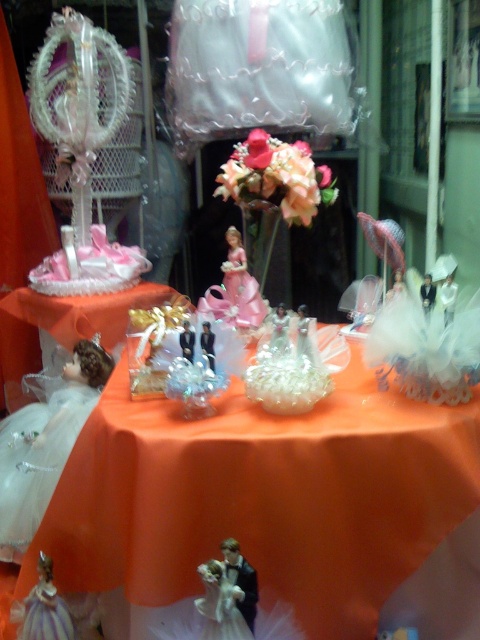
You are a customer in a bridal shop who wants to place a small gift card between the orange satin tablecloth at center and the matte black figurine at center. The gift card is 12 inches long. Will it fit between them without overlapping either object?

The orange satin tablecloth at center and matte black figurine at center are 11.82 inches apart from each other. Since the gift card is 12 inches long, it will not fit between them without overlapping either object because the distance is slightly less than the card length.